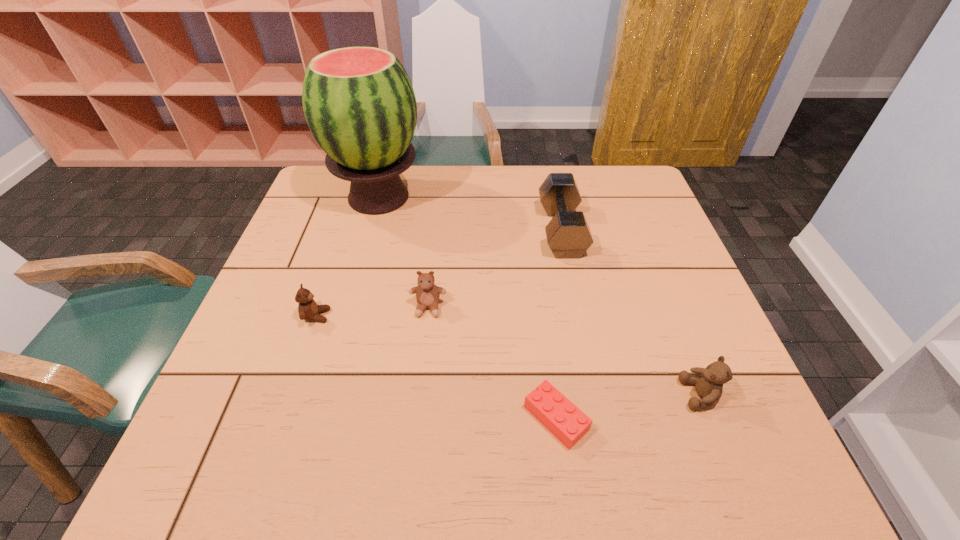
The width and height of the screenshot is (960, 540). Identify the location of free location located 0.260m on the front-facing side of the rightmost teddy bear. (548, 395).

Find the location of a particular element. This screenshot has height=540, width=960. vacant space located on the front-facing side of the rightmost teddy bear is located at coordinates (630, 395).

I want to click on vacant space located on the front-facing side of the rightmost teddy bear, so click(558, 395).

Identify the location of vacant space located at the face of the leftmost teddy bear. Image resolution: width=960 pixels, height=540 pixels. (426, 316).

Locate an element on the screen. The height and width of the screenshot is (540, 960). free space located 0.220m on the right of the shortest object is located at coordinates (706, 418).

I want to click on watermelon that is at the far edge, so click(x=359, y=103).

Where is `dumbbell present at the far edge`? Image resolution: width=960 pixels, height=540 pixels. dumbbell present at the far edge is located at coordinates (568, 234).

Locate an element on the screen. This screenshot has width=960, height=540. object that is at the near edge is located at coordinates (558, 414).

Locate an element on the screen. The height and width of the screenshot is (540, 960). watermelon that is at the left edge is located at coordinates (359, 103).

I want to click on teddy bear that is at the left edge, so click(x=308, y=309).